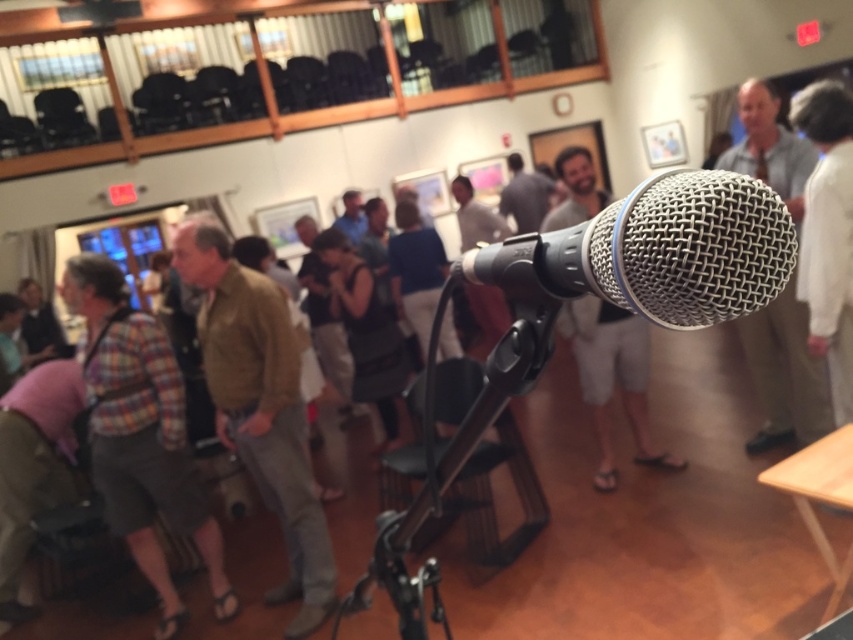
You are organizing a coat check at the event and need to store the brown leather jacket at center and the white fabric shirt at right. Given their sizes, which item requires more space in the storage closet?

The brown leather jacket at center requires more space in the storage closet because it has a larger size compared to the white fabric shirt at right.

You are at the event and want to move from the microphone to the white fabric shirt at right. Which direction should you walk relative to the brown leather jacket at center?

To reach the white fabric shirt at right, you should walk to the right of the brown leather jacket at center since it is positioned to the left of the white fabric shirt at right.

You are at a social event and need to retrieve an item from the floor. You see the brown leather jacket at center and the white fabric shirt at right. Which object is closer to the floor?

The brown leather jacket at center is closer to the floor since it is located below the white fabric shirt at right.